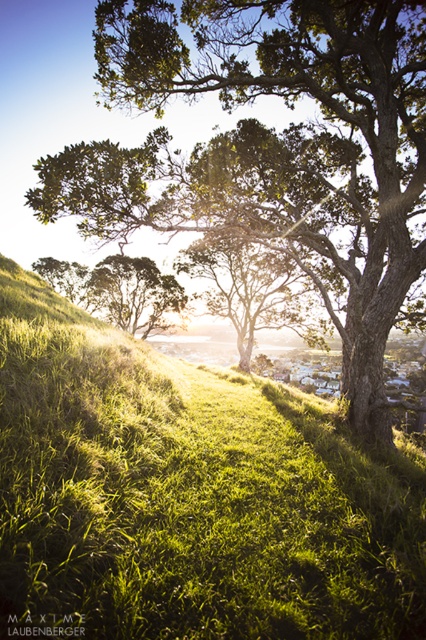
Which is above, green grassy hillside at center or green leafy tree at center?

Positioned higher is green leafy tree at center.

Is point (184, 596) behind point (146, 99)?

No, it is not.

I want to click on green grassy hillside at center, so click(187, 497).

Which is more to the right, green grassy hillside at center or green matte tree at center?

Positioned to the right is green grassy hillside at center.

Between green grassy hillside at center and green matte tree at center, which one has less height?

With less height is green grassy hillside at center.

What do you see at coordinates (187, 497) in the screenshot?
I see `green grassy hillside at center` at bounding box center [187, 497].

Where is `green grassy hillside at center`? The image size is (426, 640). green grassy hillside at center is located at coordinates (187, 497).

Between green leafy tree at center and green matte tree at center, which one appears on the left side from the viewer's perspective?

Positioned to the left is green matte tree at center.

Between green leafy tree at center and green matte tree at center, which one has less height?

Standing shorter between the two is green matte tree at center.

Locate an element on the screen. green leafy tree at center is located at coordinates (273, 150).

Where is `green leafy tree at center`? This screenshot has width=426, height=640. green leafy tree at center is located at coordinates (273, 150).